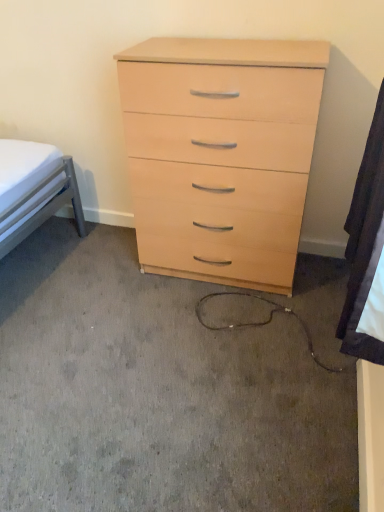
Question: Is white fabric at lower right shorter than light wood/finish chest of drawers at center?

Choices:
 (A) no
 (B) yes

Answer: (B)

Question: Is white fabric at lower right smaller than light wood/finish chest of drawers at center?

Choices:
 (A) yes
 (B) no

Answer: (A)

Question: Considering the relative positions of white fabric at lower right and light wood/finish chest of drawers at center in the image provided, is white fabric at lower right to the right of light wood/finish chest of drawers at center from the viewer's perspective?

Choices:
 (A) no
 (B) yes

Answer: (B)

Question: From a real-world perspective, is white fabric at lower right below light wood/finish chest of drawers at center?

Choices:
 (A) yes
 (B) no

Answer: (B)

Question: Is white fabric at lower right to the left of light wood/finish chest of drawers at center from the viewer's perspective?

Choices:
 (A) no
 (B) yes

Answer: (A)

Question: Is white fabric at lower right next to light wood/finish chest of drawers at center and touching it?

Choices:
 (A) no
 (B) yes

Answer: (A)

Question: Considering the relative sizes of light wood/finish chest of drawers at center and white fabric at lower right in the image provided, is light wood/finish chest of drawers at center bigger than white fabric at lower right?

Choices:
 (A) yes
 (B) no

Answer: (A)

Question: Considering the relative sizes of light wood/finish chest of drawers at center and white fabric at lower right in the image provided, is light wood/finish chest of drawers at center thinner than white fabric at lower right?

Choices:
 (A) no
 (B) yes

Answer: (A)

Question: From a real-world perspective, is light wood/finish chest of drawers at center on white fabric at lower right?

Choices:
 (A) no
 (B) yes

Answer: (A)

Question: Is light wood/finish chest of drawers at center at the left side of white fabric at lower right?

Choices:
 (A) yes
 (B) no

Answer: (A)

Question: Can you confirm if light wood/finish chest of drawers at center is shorter than white fabric at lower right?

Choices:
 (A) no
 (B) yes

Answer: (A)

Question: Is white fabric at lower right located within light wood/finish chest of drawers at center?

Choices:
 (A) yes
 (B) no

Answer: (B)

Question: Visually, is light wood/finish chest of drawers at center positioned to the left or to the right of white fabric at lower right?

Choices:
 (A) right
 (B) left

Answer: (B)